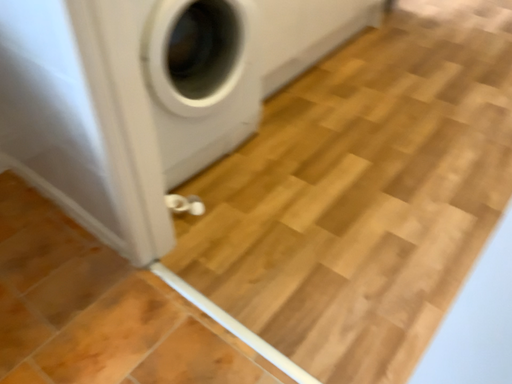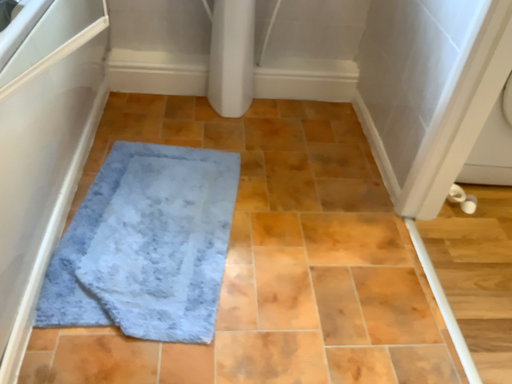
Question: How did the camera likely rotate when shooting the video?

Choices:
 (A) rotated upward
 (B) rotated downward

Answer: (A)